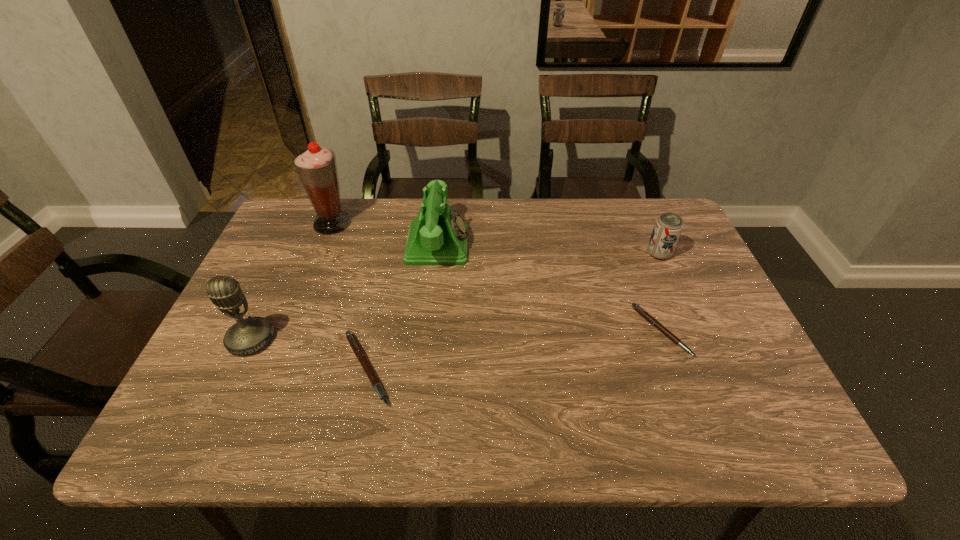
You are a GUI agent. You are given a task and a screenshot of the screen. Output one action in this format:
    pyautogui.click(x=<x>, y=<y>)
    Task: Click on the beer can present at the right edge
    The width and height of the screenshot is (960, 540).
    Given the screenshot: What is the action you would take?
    (x=668, y=227)

Locate an element on the screen. object located at the far left corner is located at coordinates click(316, 166).

Image resolution: width=960 pixels, height=540 pixels. In order to click on object present at the far right corner in this screenshot , I will do `click(668, 227)`.

Where is `free spot at the far edge of the desktop`? free spot at the far edge of the desktop is located at coordinates (619, 216).

The height and width of the screenshot is (540, 960). I want to click on vacant space at the near edge, so click(x=386, y=370).

In the image, there is a desktop. At what (x,y) coordinates should I click in order to perform the action: click on blank space at the left edge. Please return your answer as a coordinate pair (x, y). This screenshot has width=960, height=540. Looking at the image, I should click on (223, 335).

Identify the location of vacant space at the right edge. Image resolution: width=960 pixels, height=540 pixels. (688, 334).

Identify the location of vacant space at the far left corner of the desktop. This screenshot has width=960, height=540. (300, 239).

The height and width of the screenshot is (540, 960). In order to click on vacant space at the near right corner of the desktop in this screenshot , I will do `click(723, 388)`.

You are a GUI agent. You are given a task and a screenshot of the screen. Output one action in this format:
    pyautogui.click(x=<x>, y=<y>)
    Task: Click on the vacant area between the shortest object and the telephone
    This screenshot has width=960, height=540.
    Given the screenshot: What is the action you would take?
    pyautogui.click(x=549, y=288)